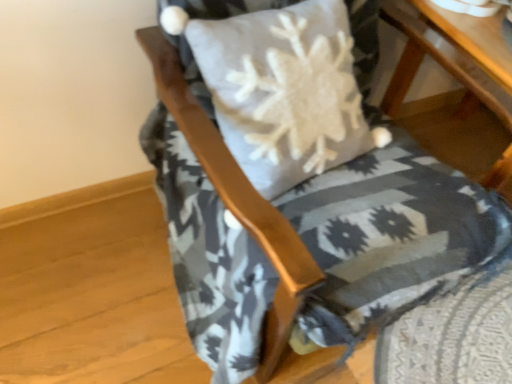
Describe the element at coordinates (392, 237) in the screenshot. I see `textured gray cushion at center` at that location.

Find the location of a particular element. textured gray cushion at center is located at coordinates pos(392,237).

The image size is (512, 384). Describe the element at coordinates (441, 61) in the screenshot. I see `wooden table at lower right` at that location.

Find the location of a particular element. Image resolution: width=512 pixels, height=384 pixels. wooden table at lower right is located at coordinates (441, 61).

Find the location of a particular element. Image resolution: width=512 pixels, height=384 pixels. textured gray cushion at center is located at coordinates (392, 237).

Which is more to the left, textured gray cushion at center or wooden table at lower right?

textured gray cushion at center is more to the left.

Looking at this image, does textured gray cushion at center lie in front of wooden table at lower right?

Yes, it is in front of wooden table at lower right.

Which is closer, (185, 199) or (499, 91)?

Point (185, 199).

From the image's perspective, is textured gray cushion at center beneath wooden table at lower right?

Indeed, from the image's perspective, textured gray cushion at center is shown beneath wooden table at lower right.

From a real-world perspective, is textured gray cushion at center beneath wooden table at lower right?

Incorrect, from a real-world perspective, textured gray cushion at center is higher than wooden table at lower right.

Which object is thinner, textured gray cushion at center or wooden table at lower right?

wooden table at lower right is thinner.

Considering the sizes of objects textured gray cushion at center and wooden table at lower right in the image provided, who is taller, textured gray cushion at center or wooden table at lower right?

With more height is textured gray cushion at center.

Is textured gray cushion at center bigger or smaller than wooden table at lower right?

textured gray cushion at center is bigger than wooden table at lower right.

Is wooden table at lower right inside textured gray cushion at center?

No.

Is textured gray cushion at center with wooden table at lower right?

No, textured gray cushion at center is not with wooden table at lower right.

Is textured gray cushion at center facing towards wooden table at lower right?

No.

How different are the orientations of textured gray cushion at center and wooden table at lower right in degrees?

0.455 degrees separate the facing orientations of textured gray cushion at center and wooden table at lower right.

The width and height of the screenshot is (512, 384). Identify the location of chair on the left of wooden table at lower right. (392, 237).

Is wooden table at lower right to the left or to the right of textured gray cushion at center in the image?

In the image, wooden table at lower right appears on the right side of textured gray cushion at center.

Is wooden table at lower right further to the viewer compared to textured gray cushion at center?

Yes, wooden table at lower right is further from the camera.

Is point (418, 46) farther from camera compared to point (237, 237)?

That is True.

From the image's perspective, who appears lower, wooden table at lower right or textured gray cushion at center?

textured gray cushion at center, from the image's perspective.

From a real-world perspective, which object rests below the other?

wooden table at lower right is physically lower.

Considering the sizes of wooden table at lower right and textured gray cushion at center in the image, is wooden table at lower right wider or thinner than textured gray cushion at center?

Clearly, wooden table at lower right has less width compared to textured gray cushion at center.

Considering the sizes of objects wooden table at lower right and textured gray cushion at center in the image provided, who is shorter, wooden table at lower right or textured gray cushion at center?

With less height is wooden table at lower right.

Considering the sizes of wooden table at lower right and textured gray cushion at center in the image, is wooden table at lower right bigger or smaller than textured gray cushion at center?

Considering their sizes, wooden table at lower right takes up less space than textured gray cushion at center.

Is wooden table at lower right positioned beyond the bounds of textured gray cushion at center?

wooden table at lower right lies outside textured gray cushion at center's area.

Based on the photo, is wooden table at lower right with textured gray cushion at center?

No, wooden table at lower right is not in contact with textured gray cushion at center.

Could you tell me if wooden table at lower right is facing textured gray cushion at center?

No, wooden table at lower right is not turned towards textured gray cushion at center.

Can you tell me how much wooden table at lower right and textured gray cushion at center differ in facing direction?

0.455 degrees separate the facing orientations of wooden table at lower right and textured gray cushion at center.

Locate an element on the screen. Image resolution: width=512 pixels, height=384 pixels. chair lying on the left of wooden table at lower right is located at coordinates (392, 237).

I want to click on chair in front of the wooden table at lower right, so click(392, 237).

You are a GUI agent. You are given a task and a screenshot of the screen. Output one action in this format:
    pyautogui.click(x=<x>, y=<y>)
    Task: Click on the chair located above the wooden table at lower right (from a real-world perspective)
    Image resolution: width=512 pixels, height=384 pixels.
    Given the screenshot: What is the action you would take?
    pyautogui.click(x=392, y=237)